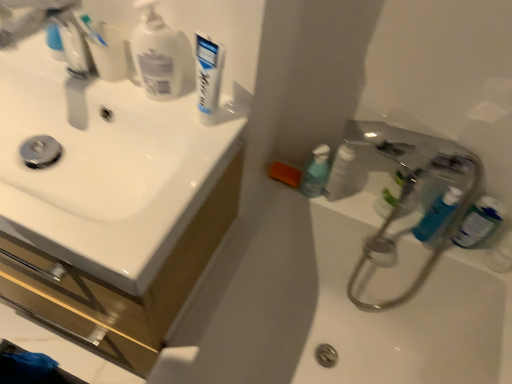
What are the coordinates of `unoccupied region to the right of white glossy toothpaste tube at right, which is counted as the first toiletry, starting from the left` in the screenshot? It's located at (369, 209).